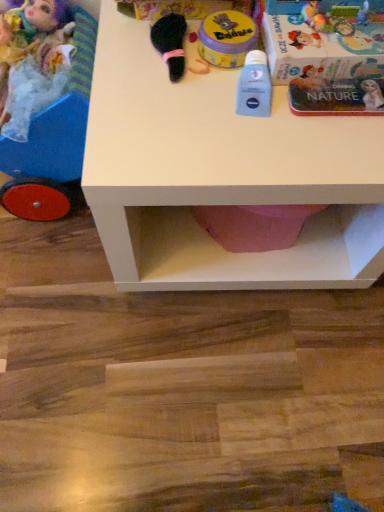
I want to click on free space in front of blue matte lotion at center, which appears as the fourth toy when viewed from the left, so click(249, 160).